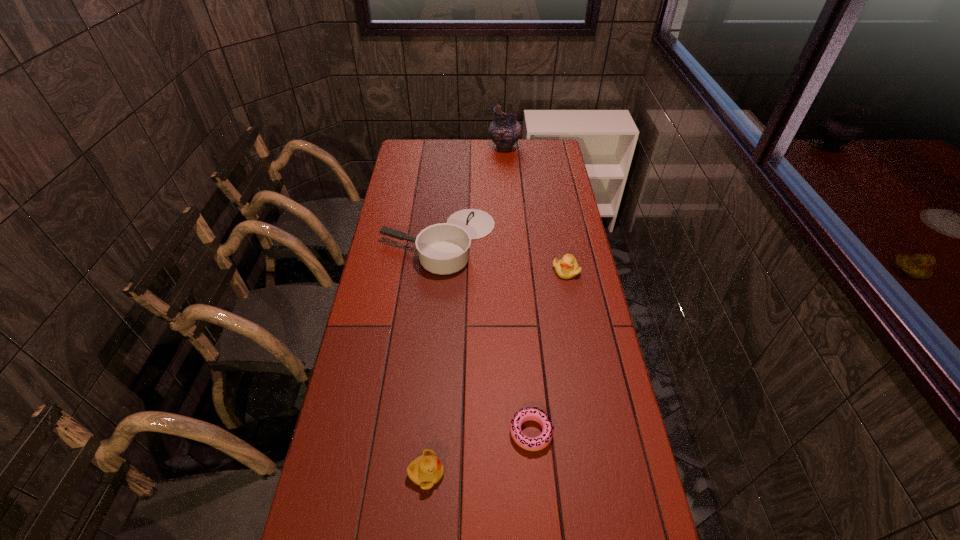
Locate an element on the screen. Image resolution: width=960 pixels, height=540 pixels. vacant space located 0.180m on the right of the saucepan is located at coordinates (540, 241).

The width and height of the screenshot is (960, 540). Identify the location of vacant space positioned on the front-facing side of the right duckling. (585, 371).

Where is `vacant space located at the beak of the nearest object`? vacant space located at the beak of the nearest object is located at coordinates (515, 473).

Locate an element on the screen. The image size is (960, 540). free space located 0.080m on the left of the shortest object is located at coordinates (480, 432).

At what (x,y) coordinates should I click in order to perform the action: click on object positioned at the far edge. Please return your answer as a coordinate pair (x, y). Image resolution: width=960 pixels, height=540 pixels. Looking at the image, I should click on click(505, 130).

Find the location of a particular element. This screenshot has width=960, height=540. object that is at the left edge is located at coordinates (444, 248).

In order to click on object located at the right edge in this screenshot , I will do `click(567, 267)`.

Find the location of a particular element. The height and width of the screenshot is (540, 960). vacant space at the far edge of the desktop is located at coordinates (453, 164).

In the image, there is a desktop. Where is `vacant space at the left edge`? This screenshot has width=960, height=540. vacant space at the left edge is located at coordinates (364, 301).

At what (x,y) coordinates should I click in order to perform the action: click on free space at the right edge. Please return your answer as a coordinate pair (x, y). Looking at the image, I should click on (532, 174).